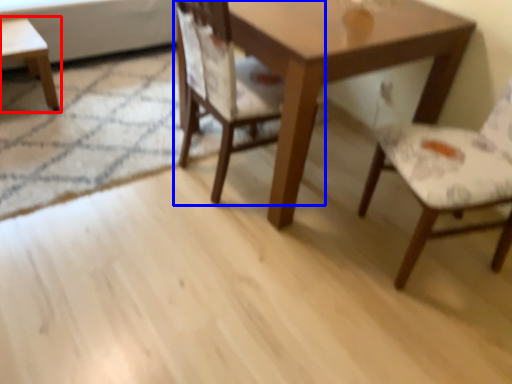
Question: Among these objects, which one is farthest to the camera, coffee table (highlighted by a red box) or chair (highlighted by a blue box)?

Choices:
 (A) coffee table
 (B) chair

Answer: (A)